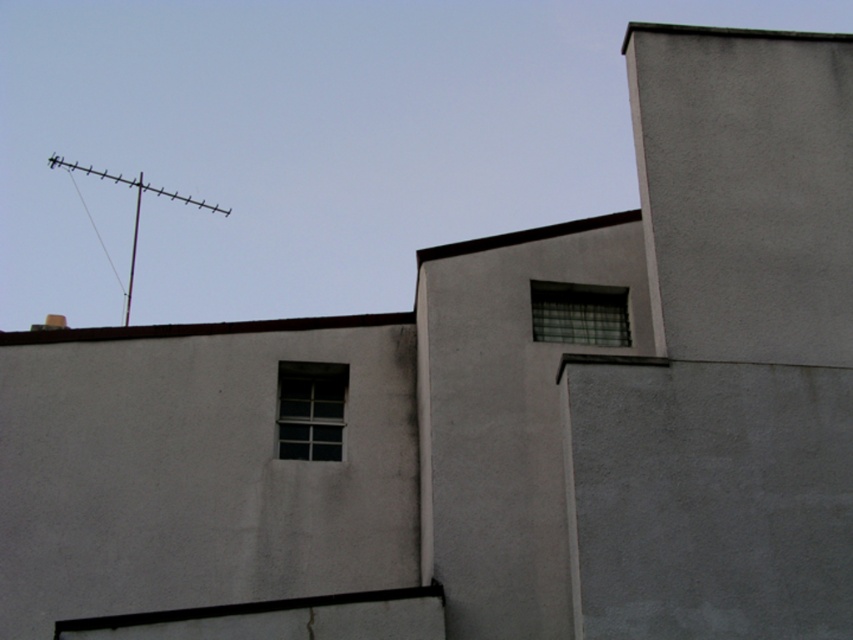
You are standing in front of a building and notice the clear glass window at center and the brown concrete roof at upper center. Which of these two objects is smaller in size?

The clear glass window at center is smaller than the brown concrete roof at upper center.

You are standing on the ground floor of the building and looking up at the clear glass window at upper right and the brown concrete roof at upper center. How far apart are these two features from your vantage point?

The clear glass window at upper right is 17.13 feet away from the brown concrete roof at upper center, so they are approximately 17.13 feet apart from your vantage point.